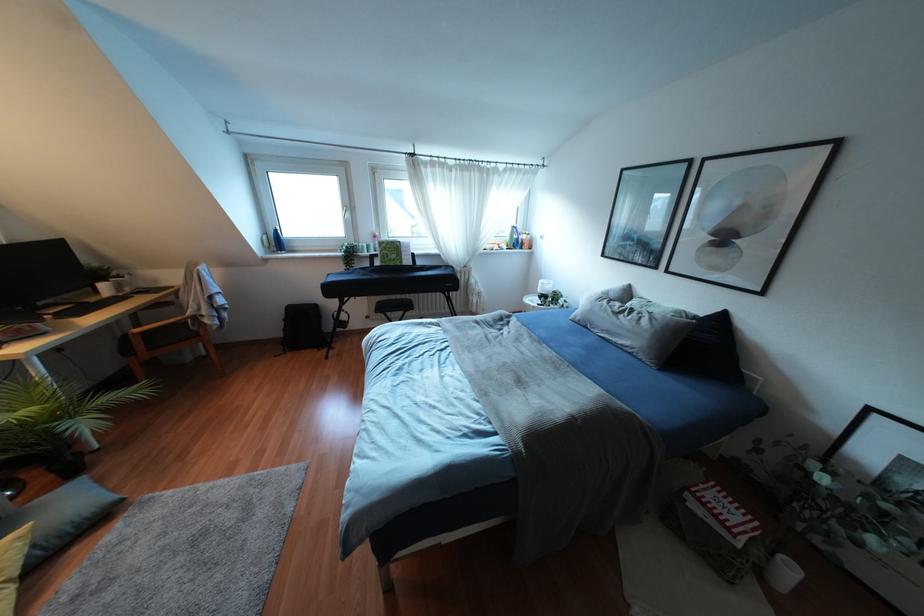
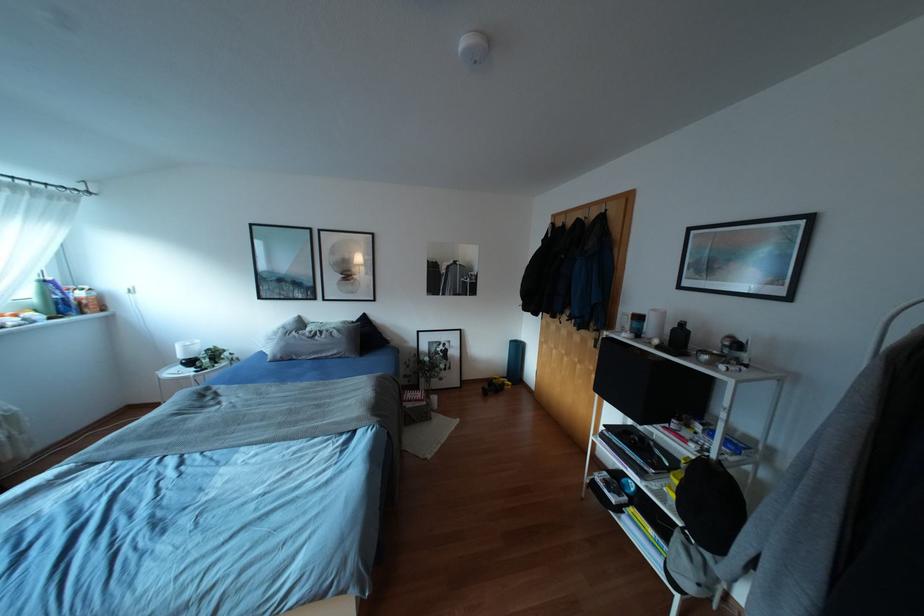
Locate, in the second image, the point that corresponds to point 722,317 in the first image.

(363, 317)